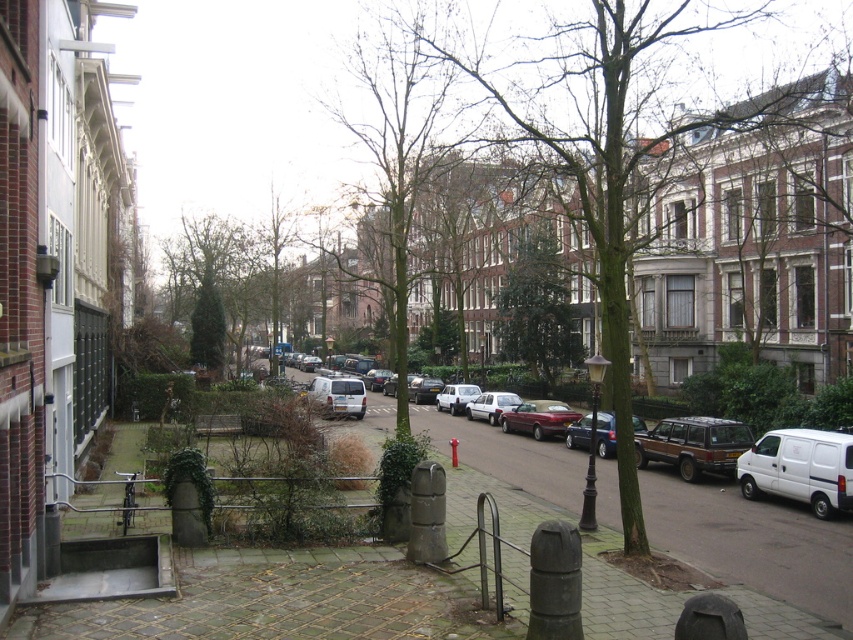
You are standing at the intersection of the walkway and the garden area in the image. Looking towards the garden, you notice a point marked at coordinates (637, 141). What object is located at that point?

The point at coordinates (637, 141) marks the location of the brown textured tree at center.

Based on the photo, you are a delivery person with a 12 feet long truck that needs to park between the brick pavement at center and the shiny maroon sedan at center. Can your truck fit in that space?

The distance between the brick pavement at center and the shiny maroon sedan at center is 13.45 feet. Since the truck is 12 feet long, it can fit in the space as there is enough room.

In the scene shown: You are a pedestrian standing on the walkway and want to cross to the garden area. There is a brown textured tree at center and a white matte car at center in your path. Which object is higher and might block your view?

The brown textured tree at center is above the white matte car at center, so the brown textured tree at center is higher and might block your view.